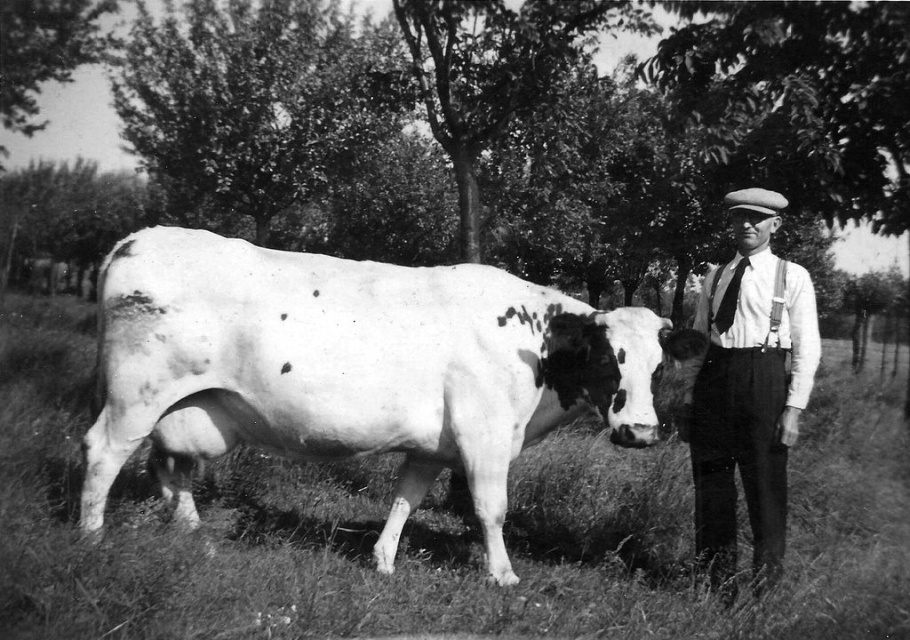
You are a photographer trying to capture the speckled white cow at center and the white striped shirt at right in the same frame. However, you notice that the cow is partially blocking the view of the shirt. Based on their positions, can you adjust your camera angle to ensure both are visible without obstruction?

The speckled white cow at center is positioned under the white striped shirt at right, so adjusting the camera angle upwards would allow both to be visible without obstruction.

You are a photographer trying to capture the speckled white cow at center and the white striped shirt at right in your shot. Which object is closer to the camera?

The speckled white cow at center is closer to the camera than the white striped shirt at right because it is in front of it.

Based on the scene described, which object is taller between the speckled white cow at center and the white striped shirt at right?

The white striped shirt at right is taller than the speckled white cow at center.